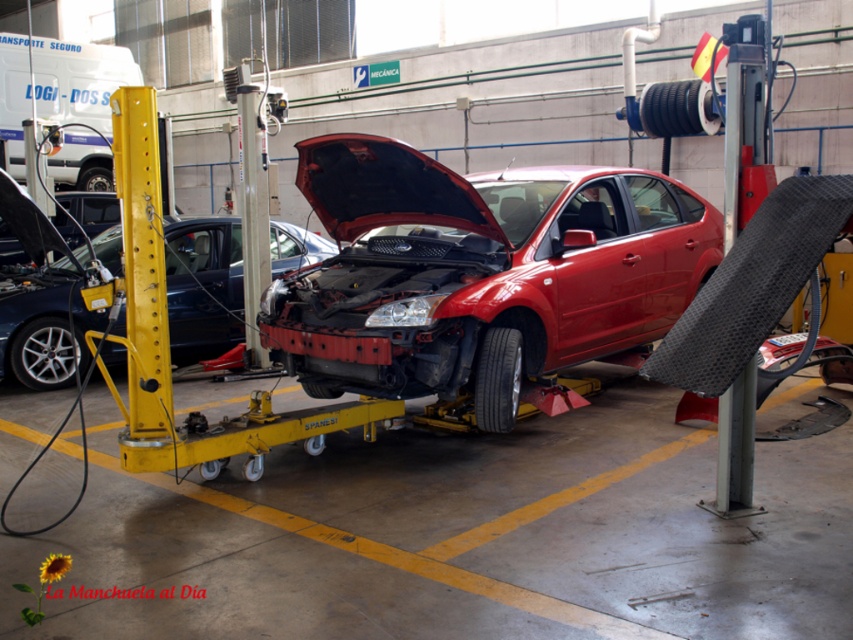
Is shiny red car at center positioned behind shiny metallic car at center?

No, it is not.

Is shiny red car at center thinner than shiny metallic car at center?

Incorrect, shiny red car at center's width is not less than shiny metallic car at center's.

Who is more forward, (289, 340) or (216, 292)?

Point (289, 340) is in front.

Locate an element on the screen. The image size is (853, 640). shiny red car at center is located at coordinates (479, 273).